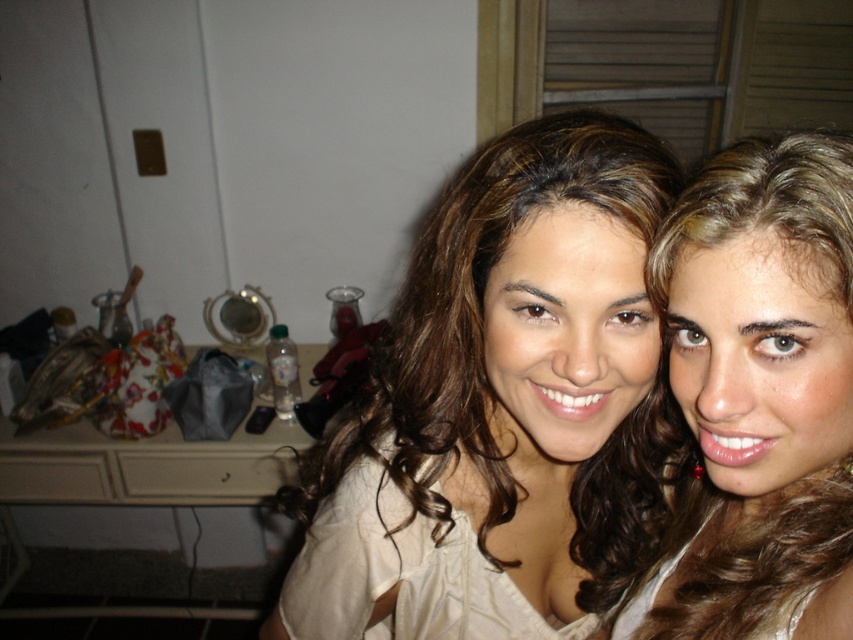
You are a tailor measuring a customer for a new blouse. The customer is standing in front of you, and you notice the point at coordinates (500, 404) on their body. What item is located at that point?

The point at coordinates (500, 404) is occupied by the matte beige blouse at center.

In the scene shown: You are trying to decide which item to grab first from the center of the image. The matte beige blouse at center and the blonde hair at center are both in your way. Which one has a larger width and would require more space to move around?

The matte beige blouse at center has a larger width than the blonde hair at center, so it would require more space to move around.

Based on the photo, you are a photographer setting up for a portrait. The subjects are wearing the matte beige blouse at center and standing 19.53 inches apart. To ensure both subjects are in focus, what minimum distance should the camera be set to, considering the depth of field?

The subjects are 19.53 inches apart. To ensure both are in focus, the camera should be set to a distance that covers this separation, typically at least 19.53 inches from the closest subject.